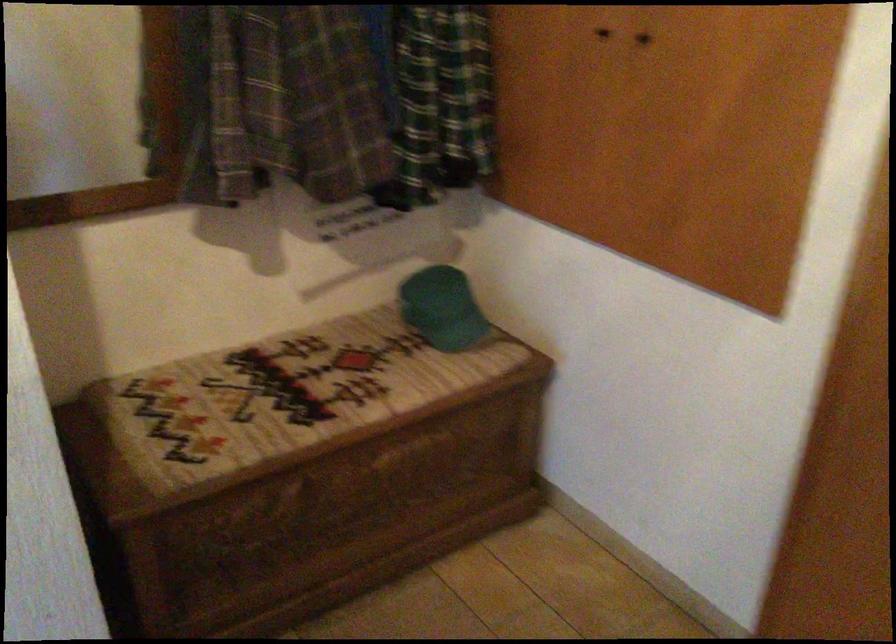
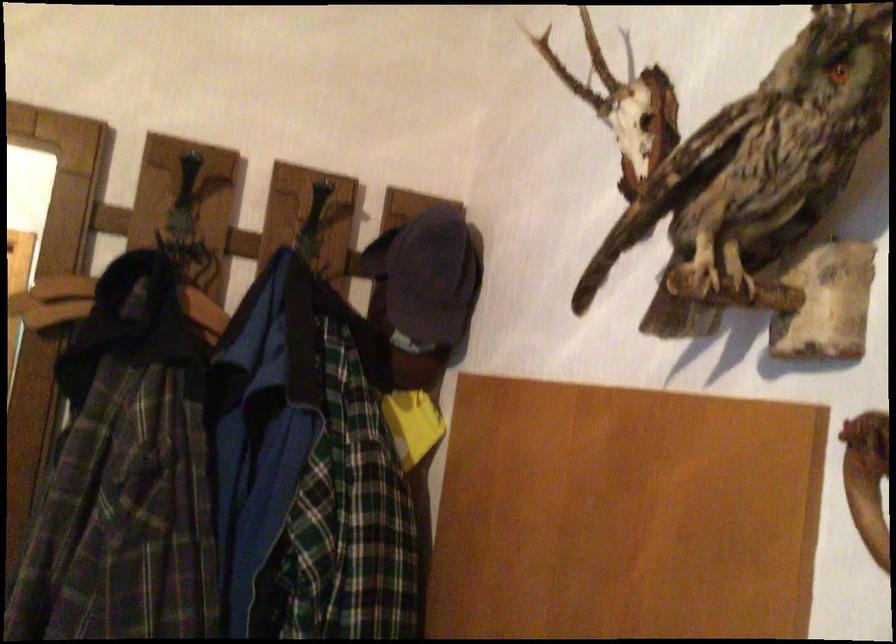
The images are taken continuously from a first-person perspective. In which direction is your viewpoint rotating?

The camera rotated toward left-up.